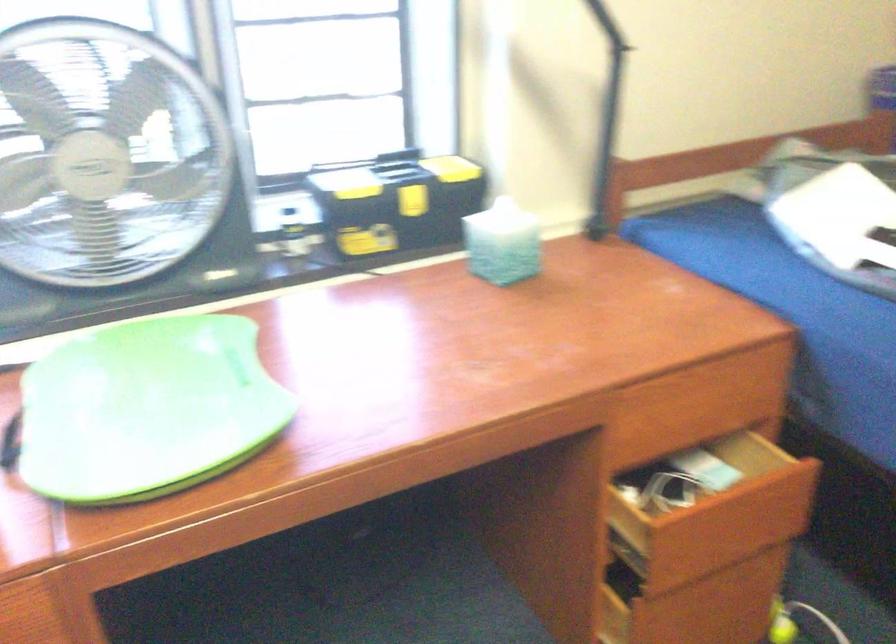
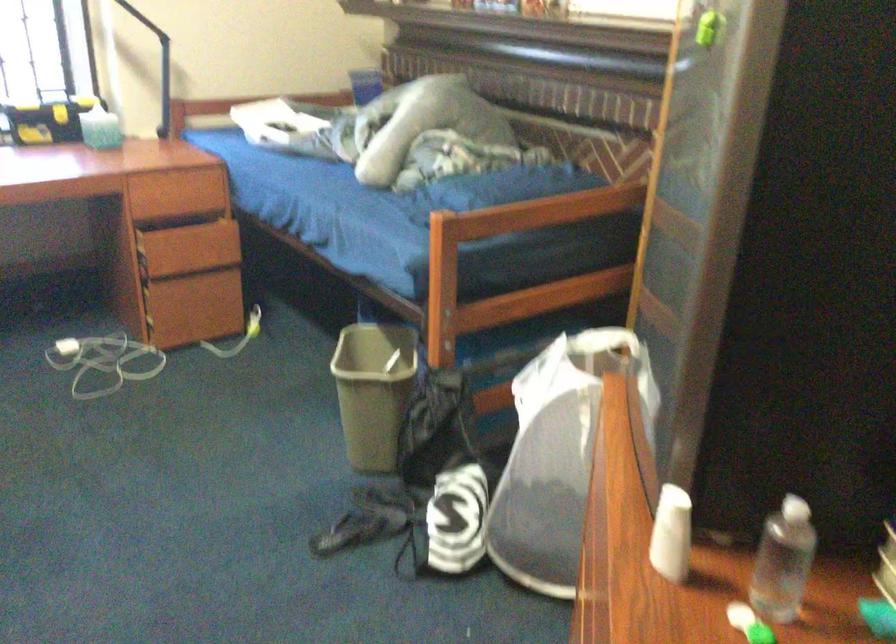
In the scene shown: What movement of the cameraman would produce the second image?

The movement direction of the cameraman is right, backward.